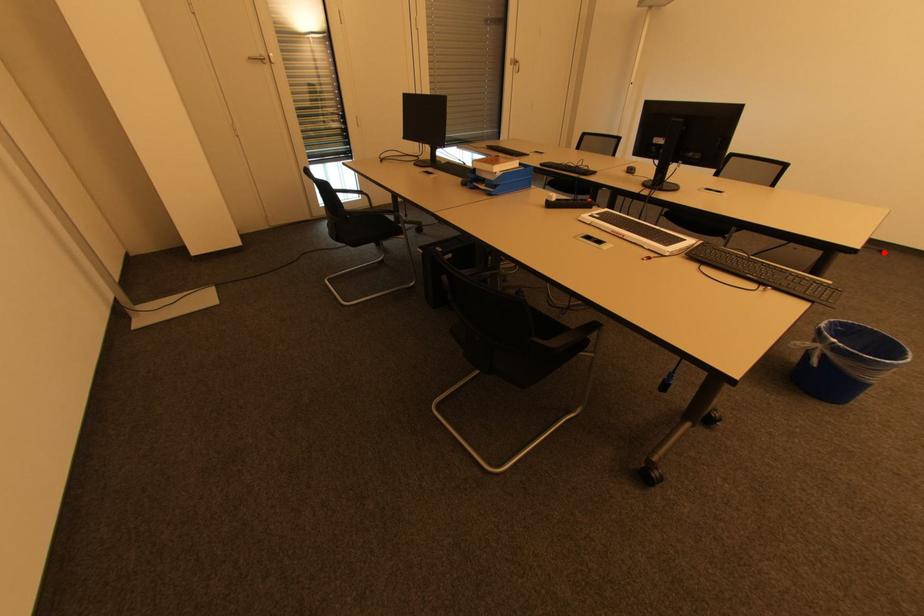
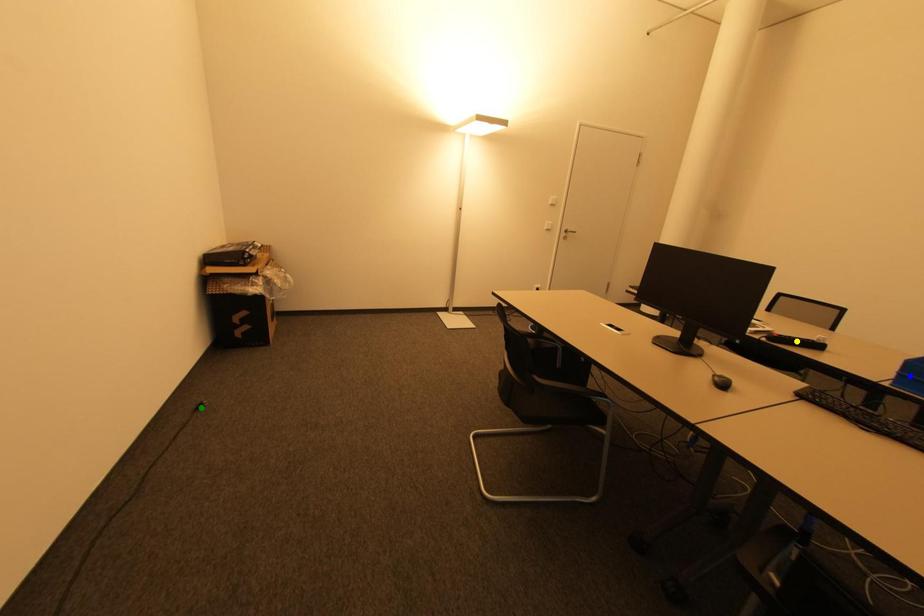
Question: I am providing you with two images of the same scene from different viewpoints. A red point is marked on the first image. You are given multiple points on the second image. Which spot in image 2 lines up with the point in image 1?

Choices:
 (A) green point
 (B) blue point
 (C) yellow point

Answer: (A)